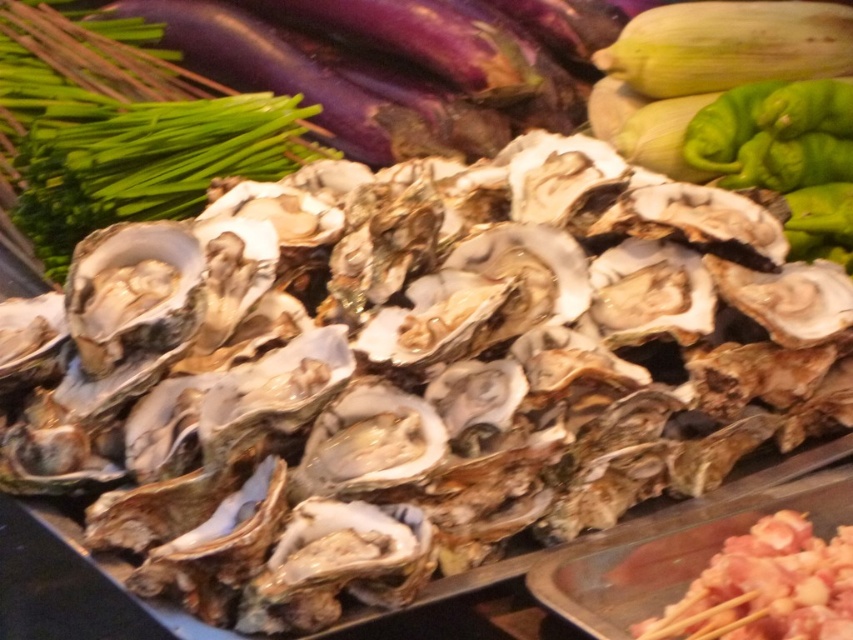
Question: Which point is farther to the camera?

Choices:
 (A) green leafy at upper left
 (B) pink raw meat at bottom right

Answer: (A)

Question: Which of the following is the closest to the observer?

Choices:
 (A) (782, 620)
 (B) (35, 13)

Answer: (A)

Question: Which point appears closest to the camera in this image?

Choices:
 (A) (848, 563)
 (B) (27, 236)

Answer: (A)

Question: Does green leafy at upper left come in front of pink raw meat at bottom right?

Choices:
 (A) no
 (B) yes

Answer: (A)

Question: Does green leafy at upper left appear under pink raw meat at bottom right?

Choices:
 (A) no
 (B) yes

Answer: (A)

Question: Is green leafy at upper left below pink raw meat at bottom right?

Choices:
 (A) no
 (B) yes

Answer: (A)